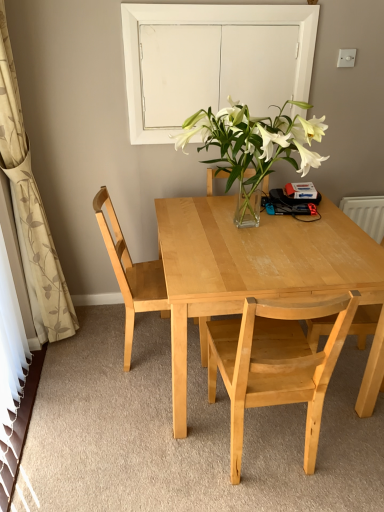
You are a GUI agent. You are given a task and a screenshot of the screen. Output one action in this format:
    pyautogui.click(x=<x>, y=<y>)
    Task: Click on the free space that is in between light wood chair at center, arranged as the second chair when viewed from the left, and light wood table at center
    
    Given the screenshot: What is the action you would take?
    pyautogui.click(x=321, y=445)